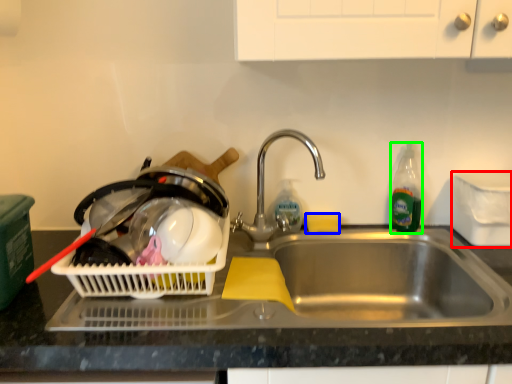
Question: Which is nearer to the appliance (highlighted by a red box)? food (highlighted by a blue box) or bottle (highlighted by a green box).

Choices:
 (A) food
 (B) bottle

Answer: (B)